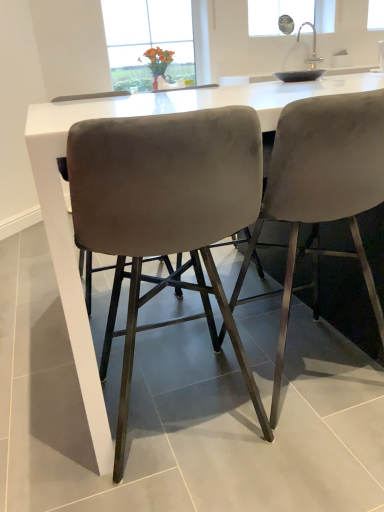
Where is `velvet grey chair at center, the second chair from the right`? This screenshot has width=384, height=512. velvet grey chair at center, the second chair from the right is located at coordinates (166, 211).

Describe the element at coordinates (166, 211) in the screenshot. I see `velvet grey chair at center, the 1th chair positioned from the left` at that location.

This screenshot has height=512, width=384. What do you see at coordinates (322, 189) in the screenshot?
I see `velvet grey bar stool at center, positioned as the 2th chair in left-to-right order` at bounding box center [322, 189].

At what (x,y) coordinates should I click in order to perform the action: click on velvet grey bar stool at center, positioned as the 2th chair in left-to-right order. Please return your answer as a coordinate pair (x, y). Looking at the image, I should click on (322, 189).

The width and height of the screenshot is (384, 512). Find the location of `velvet grey chair at center, the 1th chair positioned from the left`. velvet grey chair at center, the 1th chair positioned from the left is located at coordinates (166, 211).

Considering the relative positions of velvet grey bar stool at center, positioned as the 2th chair in left-to-right order, and velvet grey chair at center, the second chair from the right, in the image provided, is velvet grey bar stool at center, positioned as the 2th chair in left-to-right order, to the left or to the right of velvet grey chair at center, the second chair from the right,?

In the image, velvet grey bar stool at center, positioned as the 2th chair in left-to-right order, appears on the right side of velvet grey chair at center, the second chair from the right.

Considering their positions, is velvet grey bar stool at center, positioned as the 2th chair in left-to-right order, located in front of or behind velvet grey chair at center, the 1th chair positioned from the left?

velvet grey bar stool at center, positioned as the 2th chair in left-to-right order, is behind velvet grey chair at center, the 1th chair positioned from the left.

Considering the points (308, 127) and (116, 447), which point is in front, point (308, 127) or point (116, 447)?

Point (308, 127)

From the image's perspective, which object appears higher, velvet grey bar stool at center, positioned as the 2th chair in left-to-right order, or velvet grey chair at center, the second chair from the right?

velvet grey bar stool at center, positioned as the 2th chair in left-to-right order, is shown above in the image.

From a real-world perspective, between velvet grey bar stool at center, which ranks as the first chair in right-to-left order, and velvet grey chair at center, the second chair from the right, who is vertically higher?

velvet grey bar stool at center, which ranks as the first chair in right-to-left order.

Which of these two, velvet grey bar stool at center, which ranks as the first chair in right-to-left order, or velvet grey chair at center, the 1th chair positioned from the left, is wider?

Wider between the two is velvet grey bar stool at center, which ranks as the first chair in right-to-left order.

Does velvet grey bar stool at center, positioned as the 2th chair in left-to-right order, have a greater height compared to velvet grey chair at center, the 1th chair positioned from the left?

Yes, velvet grey bar stool at center, positioned as the 2th chair in left-to-right order, is taller than velvet grey chair at center, the 1th chair positioned from the left.

Which of these two, velvet grey bar stool at center, which ranks as the first chair in right-to-left order, or velvet grey chair at center, the 1th chair positioned from the left, is smaller?

velvet grey chair at center, the 1th chair positioned from the left, is smaller.

Is velvet grey bar stool at center, which ranks as the first chair in right-to-left order, outside of velvet grey chair at center, the second chair from the right?

velvet grey bar stool at center, which ranks as the first chair in right-to-left order, lies outside velvet grey chair at center, the second chair from the right,'s area.

Would you consider velvet grey bar stool at center, positioned as the 2th chair in left-to-right order, to be distant from velvet grey chair at center, the 1th chair positioned from the left?

They are positioned close to each other.

Could you tell me if velvet grey bar stool at center, which ranks as the first chair in right-to-left order, is turned towards velvet grey chair at center, the second chair from the right?

No, velvet grey bar stool at center, which ranks as the first chair in right-to-left order, is not facing towards velvet grey chair at center, the second chair from the right.

How many degrees apart are the facing directions of velvet grey bar stool at center, which ranks as the first chair in right-to-left order, and velvet grey chair at center, the 1th chair positioned from the left?

3.24e-05 degrees separate the facing orientations of velvet grey bar stool at center, which ranks as the first chair in right-to-left order, and velvet grey chair at center, the 1th chair positioned from the left.

Locate an element on the screen. The height and width of the screenshot is (512, 384). chair above the velvet grey chair at center, the second chair from the right (from the image's perspective) is located at coordinates (322, 189).

Considering the relative positions of velvet grey chair at center, the second chair from the right, and velvet grey bar stool at center, which ranks as the first chair in right-to-left order, in the image provided, is velvet grey chair at center, the second chair from the right, to the left of velvet grey bar stool at center, which ranks as the first chair in right-to-left order, from the viewer's perspective?

Yes, velvet grey chair at center, the second chair from the right, is to the left of velvet grey bar stool at center, which ranks as the first chair in right-to-left order.

In the scene shown: In the image, is velvet grey chair at center, the second chair from the right, positioned in front of or behind velvet grey bar stool at center, positioned as the 2th chair in left-to-right order?

Visually, velvet grey chair at center, the second chair from the right, is located in front of velvet grey bar stool at center, positioned as the 2th chair in left-to-right order.

Which point is more distant from viewer, (x=169, y=183) or (x=380, y=322)?

Point (x=380, y=322)

From the image's perspective, is velvet grey chair at center, the 1th chair positioned from the left, located above velvet grey bar stool at center, positioned as the 2th chair in left-to-right order?

Incorrect, from the image's perspective, velvet grey chair at center, the 1th chair positioned from the left, is lower than velvet grey bar stool at center, positioned as the 2th chair in left-to-right order.

From a real-world perspective, is velvet grey chair at center, the 1th chair positioned from the left, on top of velvet grey bar stool at center, which ranks as the first chair in right-to-left order?

No, from a real-world perspective, velvet grey chair at center, the 1th chair positioned from the left, is not over velvet grey bar stool at center, which ranks as the first chair in right-to-left order

Considering the sizes of objects velvet grey chair at center, the 1th chair positioned from the left, and velvet grey bar stool at center, which ranks as the first chair in right-to-left order, in the image provided, who is thinner, velvet grey chair at center, the 1th chair positioned from the left, or velvet grey bar stool at center, which ranks as the first chair in right-to-left order,?

velvet grey chair at center, the 1th chair positioned from the left.

Who is taller, velvet grey chair at center, the 1th chair positioned from the left, or velvet grey bar stool at center, positioned as the 2th chair in left-to-right order?

velvet grey bar stool at center, positioned as the 2th chair in left-to-right order, is taller.

Is velvet grey chair at center, the second chair from the right, smaller than velvet grey bar stool at center, which ranks as the first chair in right-to-left order?

Yes, velvet grey chair at center, the second chair from the right, is smaller than velvet grey bar stool at center, which ranks as the first chair in right-to-left order.

Is velvet grey chair at center, the 1th chair positioned from the left, positioned beyond the bounds of velvet grey bar stool at center, which ranks as the first chair in right-to-left order?

Absolutely, velvet grey chair at center, the 1th chair positioned from the left, is external to velvet grey bar stool at center, which ranks as the first chair in right-to-left order.

Is velvet grey chair at center, the second chair from the right, positioned far away from velvet grey bar stool at center, positioned as the 2th chair in left-to-right order?

No, velvet grey chair at center, the second chair from the right, is not far away from velvet grey bar stool at center, positioned as the 2th chair in left-to-right order.

Is velvet grey chair at center, the second chair from the right, oriented towards velvet grey bar stool at center, positioned as the 2th chair in left-to-right order?

No, velvet grey chair at center, the second chair from the right, is not oriented towards velvet grey bar stool at center, positioned as the 2th chair in left-to-right order.

How many degrees apart are the facing directions of velvet grey chair at center, the 1th chair positioned from the left, and velvet grey bar stool at center, which ranks as the first chair in right-to-left order?

velvet grey chair at center, the 1th chair positioned from the left, and velvet grey bar stool at center, which ranks as the first chair in right-to-left order, are facing 3.24e-05 degrees away from each other.

Measure the distance from velvet grey chair at center, the 1th chair positioned from the left, to velvet grey bar stool at center, positioned as the 2th chair in left-to-right order.

The distance of velvet grey chair at center, the 1th chair positioned from the left, from velvet grey bar stool at center, positioned as the 2th chair in left-to-right order, is 9.24 inches.

The height and width of the screenshot is (512, 384). Find the location of `chair below the velvet grey bar stool at center, positioned as the 2th chair in left-to-right order (from a real-world perspective)`. chair below the velvet grey bar stool at center, positioned as the 2th chair in left-to-right order (from a real-world perspective) is located at coordinates (166, 211).

Where is `chair on the left of velvet grey bar stool at center, positioned as the 2th chair in left-to-right order`? This screenshot has height=512, width=384. chair on the left of velvet grey bar stool at center, positioned as the 2th chair in left-to-right order is located at coordinates (166, 211).

Where is `chair that is behind the velvet grey chair at center, the 1th chair positioned from the left`? chair that is behind the velvet grey chair at center, the 1th chair positioned from the left is located at coordinates (322, 189).